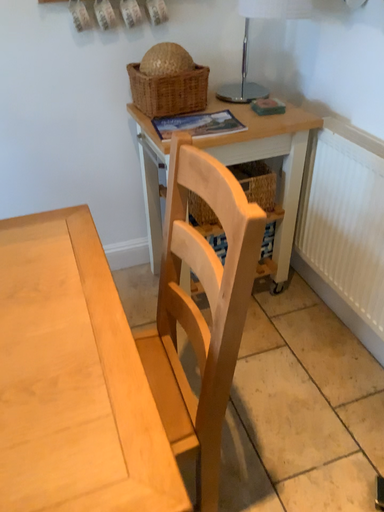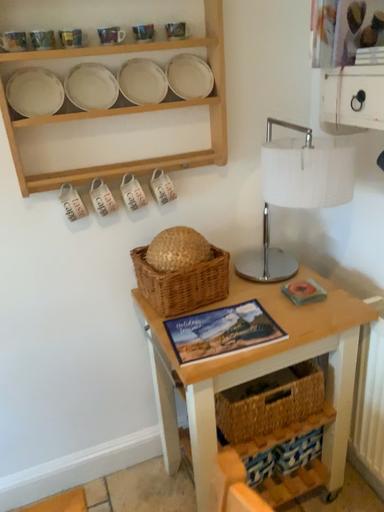
Question: Which way did the camera rotate in the video?

Choices:
 (A) rotated downward
 (B) rotated upward

Answer: (B)